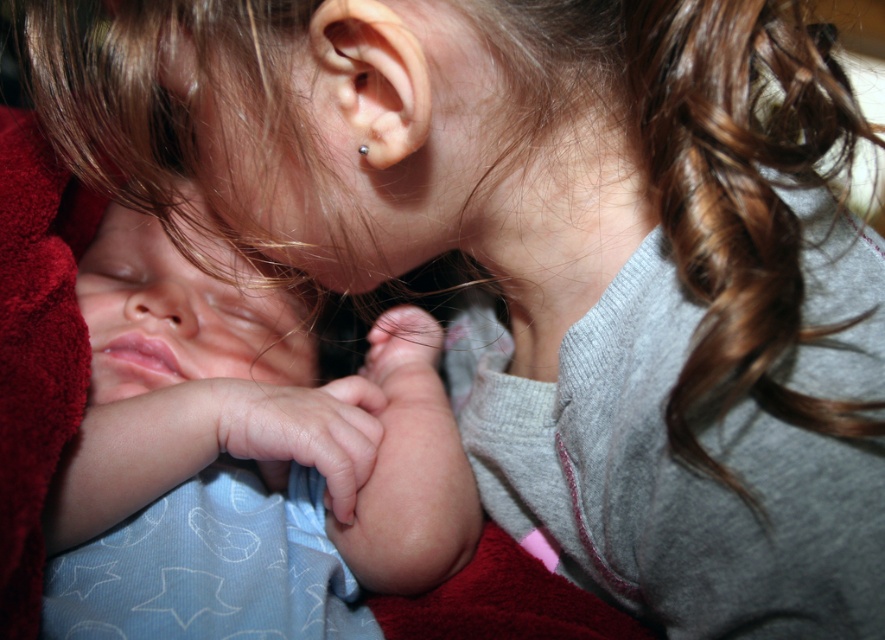
Who is more forward, (91, 397) or (354, 81)?

Positioned in front is point (354, 81).

Can you confirm if smooth blue fabric at left is smaller than smooth silver earring at upper center?

No, smooth blue fabric at left is not smaller than smooth silver earring at upper center.

Where is `smooth blue fabric at left`? Image resolution: width=885 pixels, height=640 pixels. smooth blue fabric at left is located at coordinates (244, 456).

Locate an element on the screen. This screenshot has height=640, width=885. smooth blue fabric at left is located at coordinates (244, 456).

Between smooth blue fabric at left and silver metallic earring at ear, which one appears on the right side from the viewer's perspective?

Positioned to the right is silver metallic earring at ear.

Is smooth blue fabric at left shorter than silver metallic earring at ear?

No, smooth blue fabric at left is not shorter than silver metallic earring at ear.

Locate an element on the screen. This screenshot has width=885, height=640. smooth blue fabric at left is located at coordinates (244, 456).

Does smooth silver earring at upper center appear under silver metallic earring at ear?

Incorrect, smooth silver earring at upper center is not positioned below silver metallic earring at ear.

Between smooth silver earring at upper center and silver metallic earring at ear, which one appears on the right side from the viewer's perspective?

smooth silver earring at upper center is more to the right.

What do you see at coordinates (372, 76) in the screenshot? This screenshot has width=885, height=640. I see `smooth silver earring at upper center` at bounding box center [372, 76].

Identify the location of smooth silver earring at upper center. (372, 76).